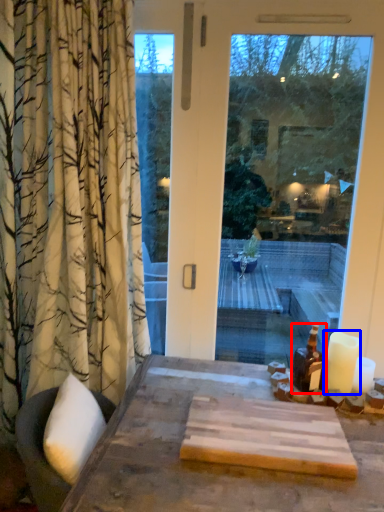
Question: Which object is further to the camera taking this photo, bottle (highlighted by a red box) or candle (highlighted by a blue box)?

Choices:
 (A) bottle
 (B) candle

Answer: (A)